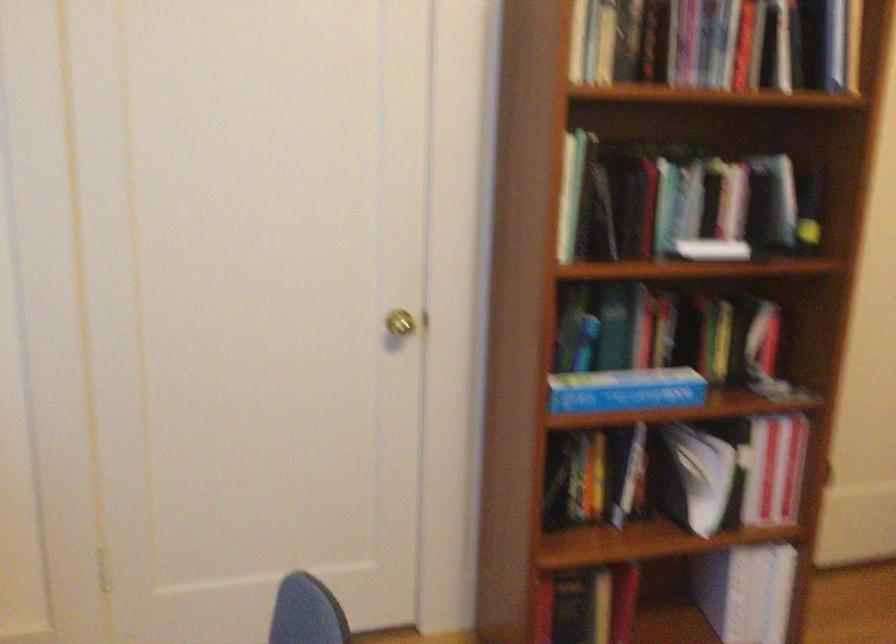
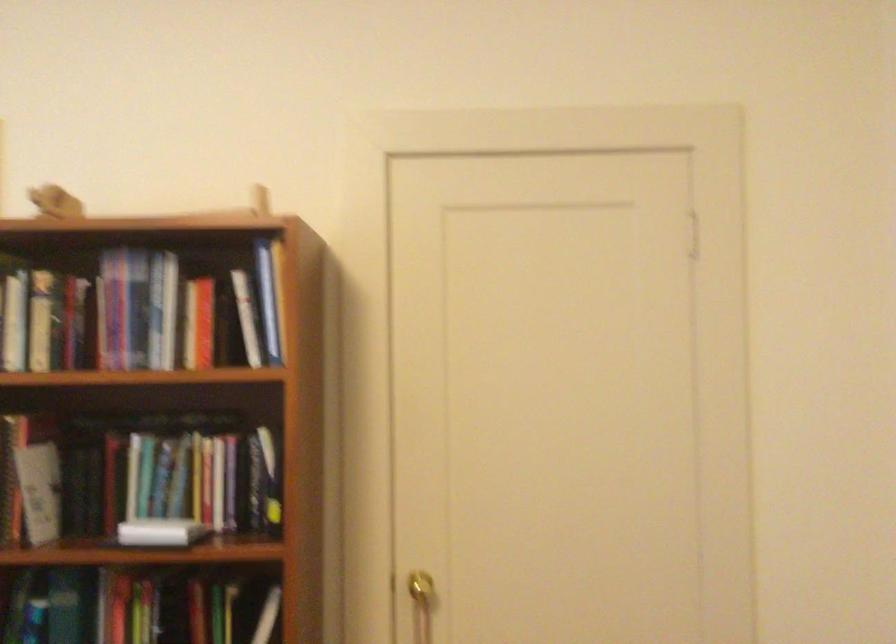
Question: In a continuous first-person perspective shot, in which direction is the camera moving?

Choices:
 (A) Left
 (B) Right
 (C) Forward
 (D) Backward

Answer: (B)